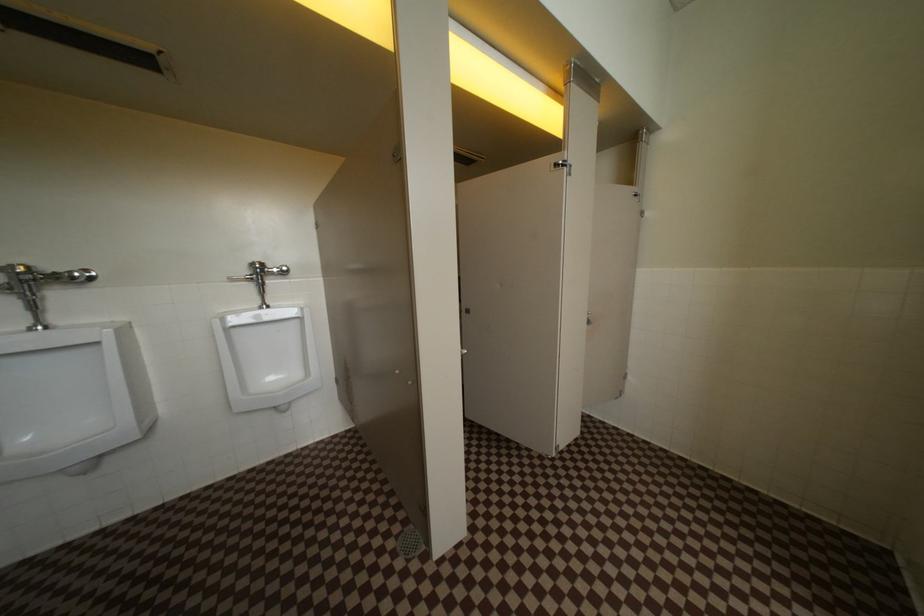
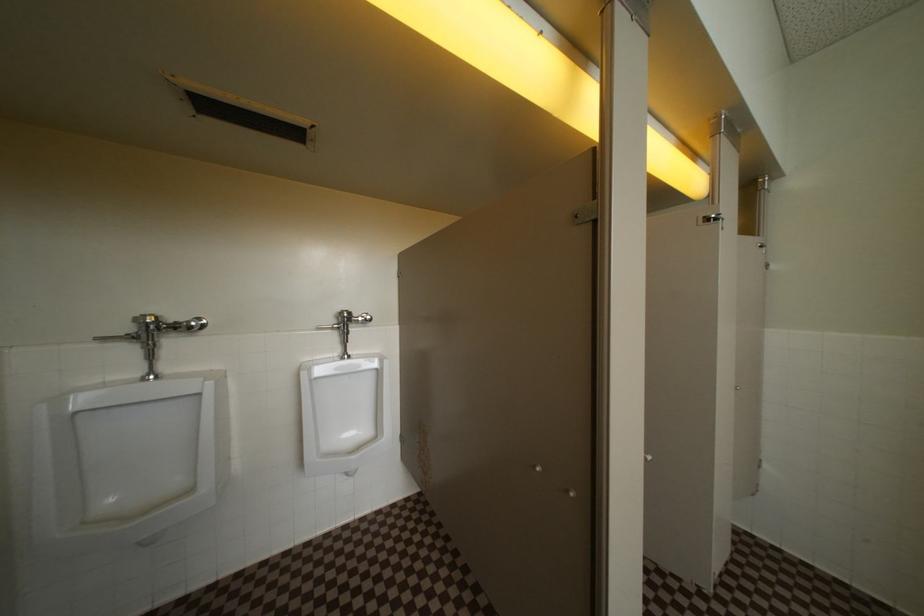
Question: In a continuous first-person perspective shot, in which direction is the camera moving?

Choices:
 (A) Left
 (B) Right
 (C) Forward
 (D) Backward

Answer: (A)